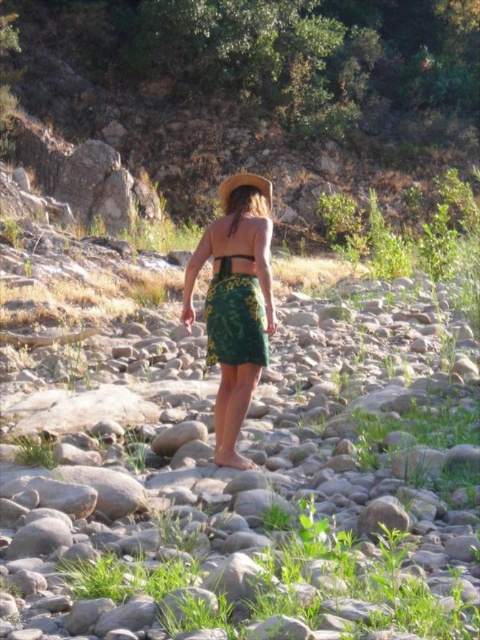
Who is shorter, green floral skirt at center or green fabric bikini top at back?

With less height is green fabric bikini top at back.

Who is higher up, green floral skirt at center or green fabric bikini top at back?

green fabric bikini top at back

Locate an element on the screen. green floral skirt at center is located at coordinates (235, 320).

Between point (233, 291) and point (259, 180), which one is positioned in front?

Positioned in front is point (233, 291).

Locate an element on the screen. This screenshot has height=640, width=480. green floral skirt at center is located at coordinates (235, 320).

Who is more forward, (216, 310) or (254, 188)?

Point (216, 310) is in front.

You are a GUI agent. You are given a task and a screenshot of the screen. Output one action in this format:
    pyautogui.click(x=<x>, y=<y>)
    Task: Click on the green floral skirt at center
    The image size is (480, 640).
    Given the screenshot: What is the action you would take?
    pyautogui.click(x=235, y=320)

Does green woven skirt at center have a lesser height compared to matte green bikini top at center?

In fact, green woven skirt at center may be taller than matte green bikini top at center.

Does point (260, 342) come farther from viewer compared to point (218, 257)?

No, it is in front of (218, 257).

Is point (226, 291) closer to viewer compared to point (233, 253)?

Yes, it is.

Find the location of a particular element. green woven skirt at center is located at coordinates (236, 305).